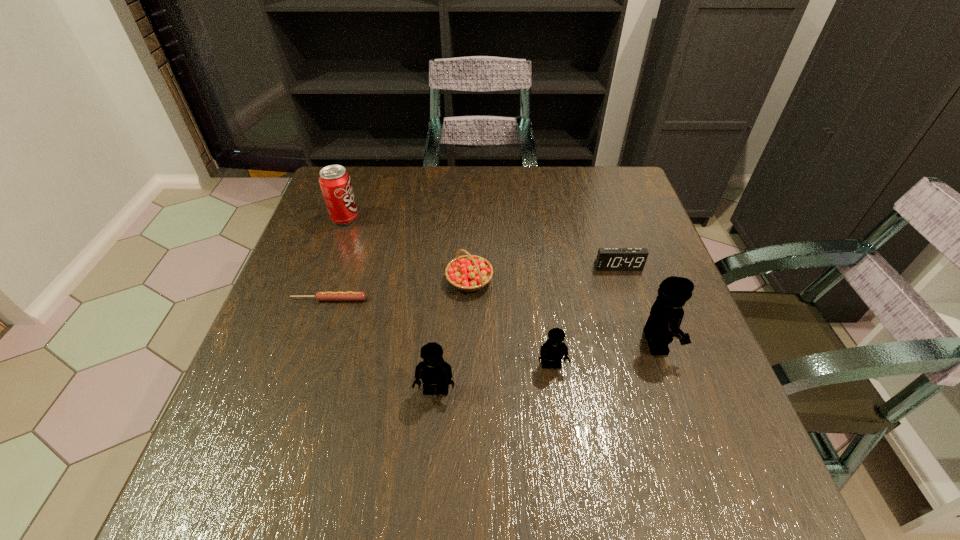
In order to click on alarm clock that is at the right edge in this screenshot , I will do `click(608, 259)`.

At what (x,y) coordinates should I click in order to perform the action: click on object that is positioned at the far left corner. Please return your answer as a coordinate pair (x, y). This screenshot has width=960, height=540. Looking at the image, I should click on (335, 182).

You are a GUI agent. You are given a task and a screenshot of the screen. Output one action in this format:
    pyautogui.click(x=<x>, y=<y>)
    Task: Click on the free space at the far edge of the desktop
    The width and height of the screenshot is (960, 540).
    Given the screenshot: What is the action you would take?
    pyautogui.click(x=520, y=166)

You are a GUI agent. You are given a task and a screenshot of the screen. Output one action in this format:
    pyautogui.click(x=<x>, y=<y>)
    Task: Click on the free space at the near edge of the desktop
    This screenshot has height=540, width=960.
    Given the screenshot: What is the action you would take?
    pyautogui.click(x=400, y=416)

This screenshot has width=960, height=540. Identify the location of vacant area at the left edge. (305, 336).

Locate an element on the screen. Image resolution: width=960 pixels, height=540 pixels. free spot at the right edge of the desktop is located at coordinates (687, 356).

In order to click on vacant area at the near left corner of the desktop in this screenshot , I will do `click(268, 423)`.

Where is `vacant space at the far right corner`? vacant space at the far right corner is located at coordinates [613, 211].

In the image, there is a desktop. What are the coordinates of `vacant space at the near right corner` in the screenshot? It's located at (659, 401).

Find the location of a particular element. The height and width of the screenshot is (540, 960). free space between the farthest object and the shortest object is located at coordinates (337, 259).